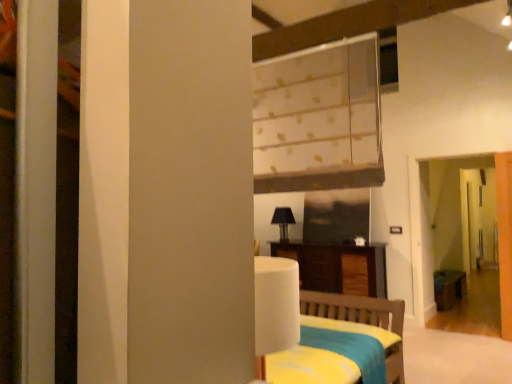
Question: From the image's perspective, does dark wood cabinet at center appear higher than white glossy door at right?

Choices:
 (A) yes
 (B) no

Answer: (B)

Question: From a real-world perspective, is dark wood cabinet at center beneath white glossy door at right?

Choices:
 (A) yes
 (B) no

Answer: (A)

Question: From the image's perspective, is dark wood cabinet at center below white glossy door at right?

Choices:
 (A) yes
 (B) no

Answer: (A)

Question: Considering the relative sizes of dark wood cabinet at center and white glossy door at right in the image provided, is dark wood cabinet at center smaller than white glossy door at right?

Choices:
 (A) yes
 (B) no

Answer: (B)

Question: Considering the relative sizes of dark wood cabinet at center and white glossy door at right in the image provided, is dark wood cabinet at center thinner than white glossy door at right?

Choices:
 (A) yes
 (B) no

Answer: (B)

Question: From a real-world perspective, is dark wood cabinet at center physically above white glossy door at right?

Choices:
 (A) no
 (B) yes

Answer: (A)

Question: Is transparent glass screen door at right positioned with its back to wooden table at right?

Choices:
 (A) yes
 (B) no

Answer: (A)

Question: Can you confirm if transparent glass screen door at right is smaller than wooden table at right?

Choices:
 (A) no
 (B) yes

Answer: (A)

Question: Is transparent glass screen door at right positioned in front of wooden table at right?

Choices:
 (A) no
 (B) yes

Answer: (B)

Question: Does transparent glass screen door at right appear on the right side of wooden table at right?

Choices:
 (A) no
 (B) yes

Answer: (A)

Question: Is transparent glass screen door at right shorter than wooden table at right?

Choices:
 (A) yes
 (B) no

Answer: (B)

Question: From a real-world perspective, is transparent glass screen door at right on wooden table at right?

Choices:
 (A) yes
 (B) no

Answer: (A)

Question: From a real-world perspective, does white glossy door at right sit lower than wooden table at right?

Choices:
 (A) yes
 (B) no

Answer: (B)